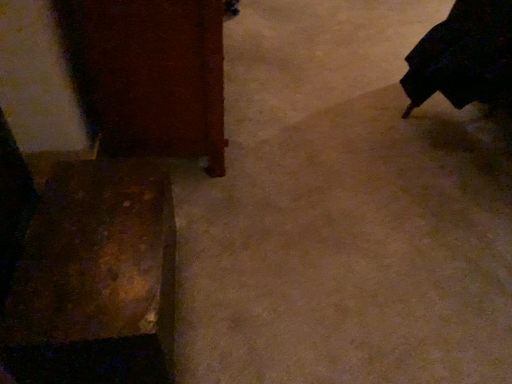
Question: Can you confirm if black matte robe at right is shorter than wooden cabinet at left, arranged as the 2th furniture when ordered from the bottom?

Choices:
 (A) no
 (B) yes

Answer: (B)

Question: Is black matte robe at right turned away from wooden cabinet at left, which is the first furniture from top to bottom?

Choices:
 (A) yes
 (B) no

Answer: (B)

Question: Is black matte robe at right further to the viewer compared to wooden cabinet at left, which is the first furniture from top to bottom?

Choices:
 (A) no
 (B) yes

Answer: (B)

Question: From a real-world perspective, is black matte robe at right under wooden cabinet at left, which is the first furniture from top to bottom?

Choices:
 (A) no
 (B) yes

Answer: (A)

Question: Considering the relative sizes of black matte robe at right and wooden cabinet at left, arranged as the 2th furniture when ordered from the bottom, in the image provided, is black matte robe at right wider than wooden cabinet at left, arranged as the 2th furniture when ordered from the bottom,?

Choices:
 (A) yes
 (B) no

Answer: (A)

Question: From a real-world perspective, is rusty metal box at lower left, the first furniture when ordered from bottom to top, positioned above or below black matte robe at right?

Choices:
 (A) above
 (B) below

Answer: (B)

Question: From the image's perspective, is rusty metal box at lower left, the first furniture when ordered from bottom to top, located above or below black matte robe at right?

Choices:
 (A) above
 (B) below

Answer: (B)

Question: Choose the correct answer: Is rusty metal box at lower left, the 2th furniture from the top, inside black matte robe at right or outside it?

Choices:
 (A) outside
 (B) inside

Answer: (A)

Question: In terms of height, does rusty metal box at lower left, the first furniture when ordered from bottom to top, look taller or shorter compared to black matte robe at right?

Choices:
 (A) short
 (B) tall

Answer: (A)

Question: From the image's perspective, relative to rusty metal box at lower left, the first furniture when ordered from bottom to top, is black matte robe at right above or below?

Choices:
 (A) above
 (B) below

Answer: (A)

Question: Based on their positions, is black matte robe at right located to the left or right of rusty metal box at lower left, the 2th furniture from the top?

Choices:
 (A) right
 (B) left

Answer: (A)

Question: Considering their positions, is black matte robe at right located in front of or behind rusty metal box at lower left, the first furniture when ordered from bottom to top?

Choices:
 (A) behind
 (B) front

Answer: (A)

Question: Does point (490, 31) appear closer or farther from the camera than point (133, 196)?

Choices:
 (A) farther
 (B) closer

Answer: (A)

Question: In terms of width, does rusty metal box at lower left, the 2th furniture from the top, look wider or thinner when compared to wooden cabinet at left, arranged as the 2th furniture when ordered from the bottom?

Choices:
 (A) thin
 (B) wide

Answer: (A)

Question: From a real-world perspective, is rusty metal box at lower left, the first furniture when ordered from bottom to top, physically located above or below wooden cabinet at left, which is the first furniture from top to bottom?

Choices:
 (A) below
 (B) above

Answer: (A)